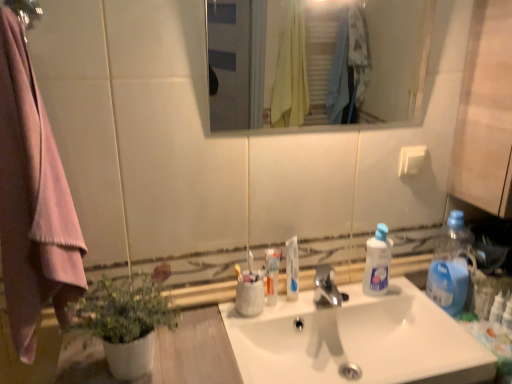
Question: Is white glossy toothpaste at center, which ranks as the second toothpaste in right-to-left order, to the left of yellow plastic toothbrush at center, positioned as the 2th toothbrush in right-to-left order, from the viewer's perspective?

Choices:
 (A) no
 (B) yes

Answer: (A)

Question: Can you confirm if white glossy toothpaste at center, which ranks as the second toothpaste in right-to-left order, is wider than yellow plastic toothbrush at center, positioned as the 2th toothbrush in right-to-left order?

Choices:
 (A) yes
 (B) no

Answer: (A)

Question: Can you confirm if white glossy toothpaste at center, which ranks as the second toothpaste in right-to-left order, is smaller than yellow plastic toothbrush at center, marked as the 1th toothbrush in a left-to-right arrangement?

Choices:
 (A) no
 (B) yes

Answer: (A)

Question: From a real-world perspective, is white glossy toothpaste at center, which ranks as the second toothpaste in right-to-left order, over yellow plastic toothbrush at center, marked as the 1th toothbrush in a left-to-right arrangement?

Choices:
 (A) no
 (B) yes

Answer: (A)

Question: From the image's perspective, does white glossy toothpaste at center, the 1th toothpaste from the left, appear higher than yellow plastic toothbrush at center, positioned as the 2th toothbrush in right-to-left order?

Choices:
 (A) no
 (B) yes

Answer: (A)

Question: Is point (272, 119) closer or farther from the camera than point (285, 243)?

Choices:
 (A) closer
 (B) farther

Answer: (B)

Question: Considering the relative positions of clear glass mirror at upper center and white glossy toothpaste at center, placed as the first toothpaste when sorted from right to left, in the image provided, is clear glass mirror at upper center to the left or to the right of white glossy toothpaste at center, placed as the first toothpaste when sorted from right to left,?

Choices:
 (A) right
 (B) left

Answer: (A)

Question: From the image's perspective, is clear glass mirror at upper center above or below white glossy toothpaste at center, placed as the first toothpaste when sorted from right to left?

Choices:
 (A) above
 (B) below

Answer: (A)

Question: Is clear glass mirror at upper center wider or thinner than white glossy toothpaste at center, the 2th toothpaste from the left?

Choices:
 (A) thin
 (B) wide

Answer: (B)

Question: Is white glossy toothpaste at center, placed as the first toothpaste when sorted from right to left, inside the boundaries of yellow plastic toothbrush at center, marked as the 1th toothbrush in a left-to-right arrangement, or outside?

Choices:
 (A) inside
 (B) outside

Answer: (B)

Question: Is point (287, 278) closer or farther from the camera than point (236, 269)?

Choices:
 (A) farther
 (B) closer

Answer: (A)

Question: In terms of height, does white glossy toothpaste at center, the 2th toothpaste from the left, look taller or shorter compared to yellow plastic toothbrush at center, marked as the 1th toothbrush in a left-to-right arrangement?

Choices:
 (A) short
 (B) tall

Answer: (B)

Question: From the image's perspective, is white glossy toothpaste at center, the 2th toothpaste from the left, positioned above or below yellow plastic toothbrush at center, positioned as the 2th toothbrush in right-to-left order?

Choices:
 (A) above
 (B) below

Answer: (B)

Question: In terms of height, does white glossy toothpaste at center, the 1th toothpaste from the left, look taller or shorter compared to blue plastic bottle at right, the 1th bottle viewed from the right?

Choices:
 (A) short
 (B) tall

Answer: (A)

Question: Considering the positions of white glossy toothpaste at center, which ranks as the second toothpaste in right-to-left order, and blue plastic bottle at right, acting as the 2th bottle starting from the left, in the image, is white glossy toothpaste at center, which ranks as the second toothpaste in right-to-left order, bigger or smaller than blue plastic bottle at right, acting as the 2th bottle starting from the left,?

Choices:
 (A) big
 (B) small

Answer: (B)